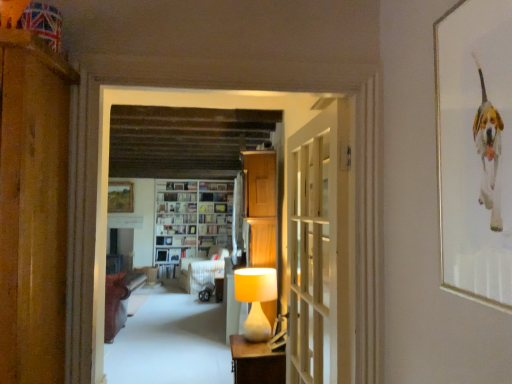
Question: Is matte cream lampshade at center looking in the opposite direction of hardcover book at center, the 1th book from the top?

Choices:
 (A) no
 (B) yes

Answer: (A)

Question: Is matte cream lampshade at center at the right side of hardcover book at center, the 1th book from the top?

Choices:
 (A) yes
 (B) no

Answer: (A)

Question: Does matte cream lampshade at center touch hardcover book at center, the 1th book from the top?

Choices:
 (A) yes
 (B) no

Answer: (B)

Question: Could you tell me if matte cream lampshade at center is turned towards hardcover book at center, placed as the fifth book when sorted from bottom to top?

Choices:
 (A) yes
 (B) no

Answer: (B)

Question: Would you say matte cream lampshade at center is outside hardcover book at center, the 1th book from the top?

Choices:
 (A) yes
 (B) no

Answer: (A)

Question: Are matte cream lampshade at center and hardcover book at center, placed as the fifth book when sorted from bottom to top, located far from each other?

Choices:
 (A) yes
 (B) no

Answer: (A)

Question: Can you confirm if white glossy bookshelf at center is shorter than hardcover book at center, the 2th book positioned from the bottom?

Choices:
 (A) yes
 (B) no

Answer: (B)

Question: Considering the relative positions of white glossy bookshelf at center and hardcover book at center, marked as the fourth book in a top-to-bottom arrangement, in the image provided, is white glossy bookshelf at center to the left of hardcover book at center, marked as the fourth book in a top-to-bottom arrangement, from the viewer's perspective?

Choices:
 (A) yes
 (B) no

Answer: (B)

Question: Considering the relative positions of white glossy bookshelf at center and hardcover book at center, marked as the fourth book in a top-to-bottom arrangement, in the image provided, is white glossy bookshelf at center in front of hardcover book at center, marked as the fourth book in a top-to-bottom arrangement,?

Choices:
 (A) no
 (B) yes

Answer: (B)

Question: Is white glossy bookshelf at center positioned with its back to hardcover book at center, marked as the fourth book in a top-to-bottom arrangement?

Choices:
 (A) yes
 (B) no

Answer: (A)

Question: Can you confirm if white glossy bookshelf at center is wider than hardcover book at center, marked as the fourth book in a top-to-bottom arrangement?

Choices:
 (A) no
 (B) yes

Answer: (B)

Question: From the image's perspective, is white glossy bookshelf at center above hardcover book at center, the 2th book positioned from the bottom?

Choices:
 (A) yes
 (B) no

Answer: (A)

Question: Is white glossy bookshelf at center, which is the third book from top to bottom, in contact with brown leather sofa at left, placed as the second furniture when sorted from back to front?

Choices:
 (A) no
 (B) yes

Answer: (A)